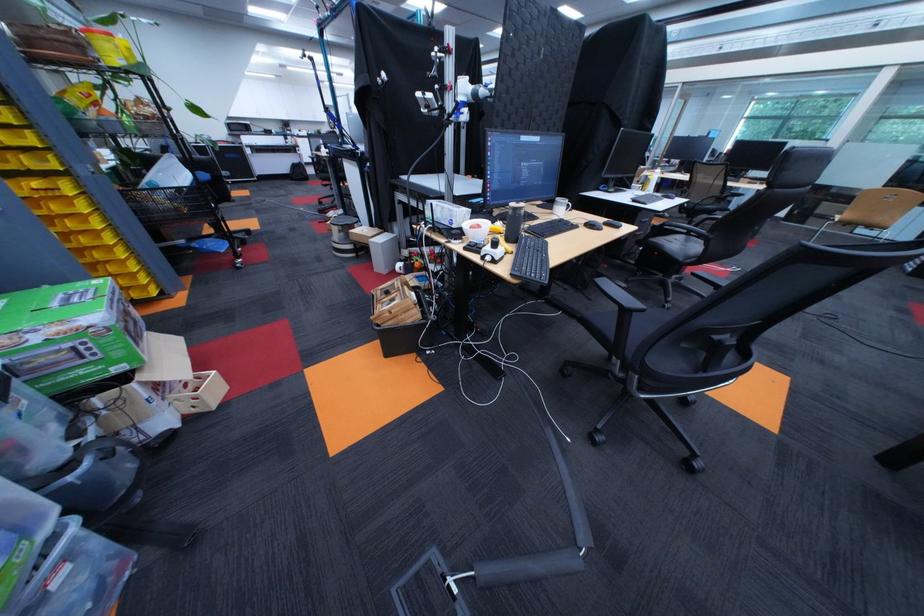
Which object does [69,334] point to?

It corresponds to the green cardboard box in the image.